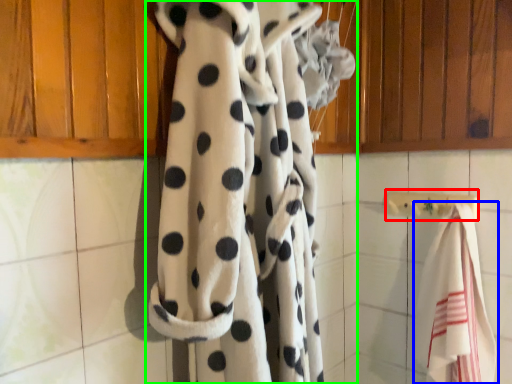
Question: Estimate the real-world distances between objects in this image. Which object is farther from towel bar (highlighted by a red box), towel (highlighted by a blue box) or curtain (highlighted by a green box)?

Choices:
 (A) towel
 (B) curtain

Answer: (B)